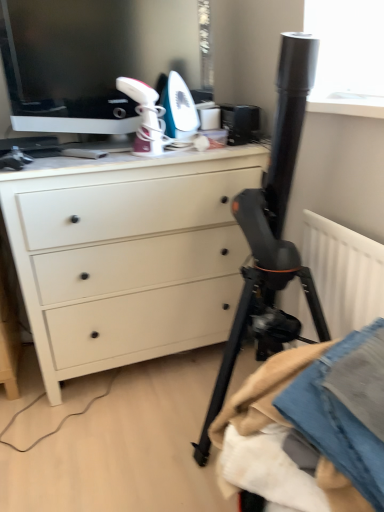
At what (x,y) coordinates should I click in order to perform the action: click on free space in front of white matte chest of drawers at center. Please return your answer as a coordinate pair (x, y). The height and width of the screenshot is (512, 384). Looking at the image, I should click on (108, 444).